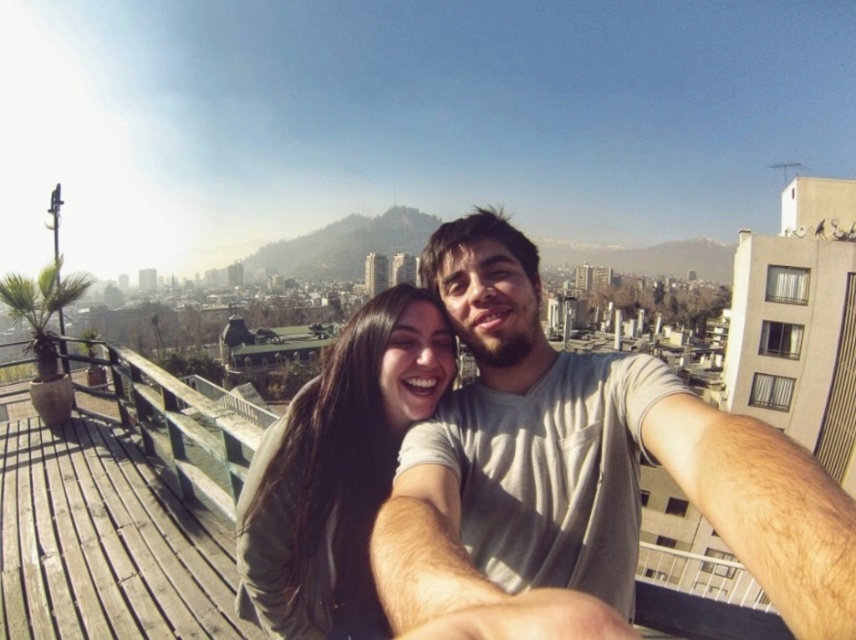
Question: Does light gray t-shirt at center have a lesser width compared to matte green sweater at center?

Choices:
 (A) no
 (B) yes

Answer: (A)

Question: Is light gray t-shirt at center smaller than matte green sweater at center?

Choices:
 (A) yes
 (B) no

Answer: (B)

Question: Is light gray t-shirt at center below matte green sweater at center?

Choices:
 (A) yes
 (B) no

Answer: (B)

Question: Which object appears closest to the camera in this image?

Choices:
 (A) matte green sweater at center
 (B) light gray t-shirt at center

Answer: (B)

Question: Among these objects, which one is nearest to the camera?

Choices:
 (A) matte green sweater at center
 (B) light gray t-shirt at center

Answer: (B)